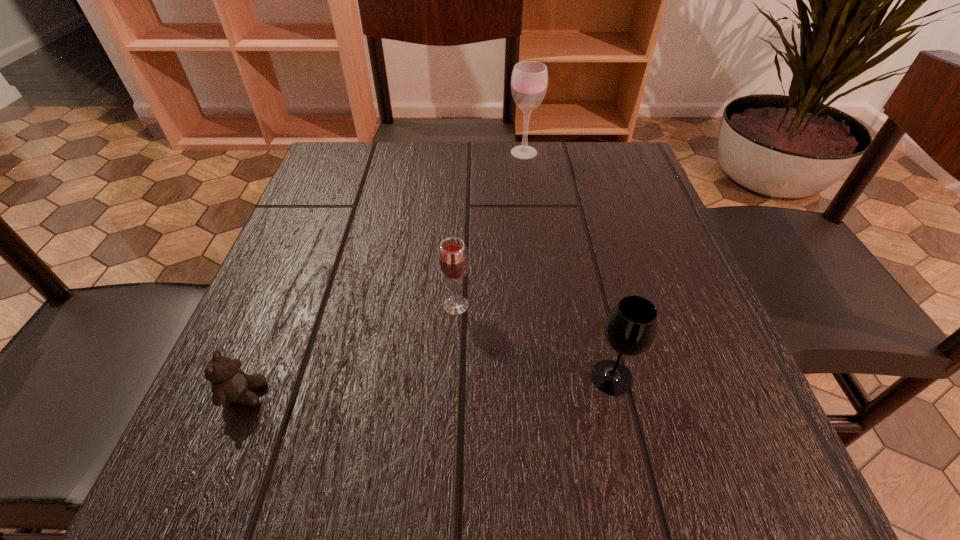
The width and height of the screenshot is (960, 540). Identify the location of the tallest object. (529, 80).

At what (x,y) coordinates should I click in order to perform the action: click on the tallest wineglass. Please return your answer as a coordinate pair (x, y). The image size is (960, 540). Looking at the image, I should click on (529, 80).

Find the location of a particular element. The width and height of the screenshot is (960, 540). the rightmost wineglass is located at coordinates (630, 329).

Identify the location of the nearest wineglass. The height and width of the screenshot is (540, 960). (630, 329).

Find the location of a particular element. The height and width of the screenshot is (540, 960). the second object from left to right is located at coordinates (453, 260).

At what (x,y) coordinates should I click in order to perform the action: click on the leftmost wineglass. Please return your answer as a coordinate pair (x, y). The height and width of the screenshot is (540, 960). Looking at the image, I should click on tap(453, 260).

I want to click on the leftmost object, so click(230, 384).

Locate an element on the screen. The image size is (960, 540). teddy bear is located at coordinates (230, 384).

At what (x,y) coordinates should I click in order to perform the action: click on vacant space situated 0.080m on the left of the second object from right to left. Please return your answer as a coordinate pair (x, y). The height and width of the screenshot is (540, 960). Looking at the image, I should click on (475, 152).

Where is `vacant space positioned 0.360m on the back of the nearest wineglass`? vacant space positioned 0.360m on the back of the nearest wineglass is located at coordinates (573, 212).